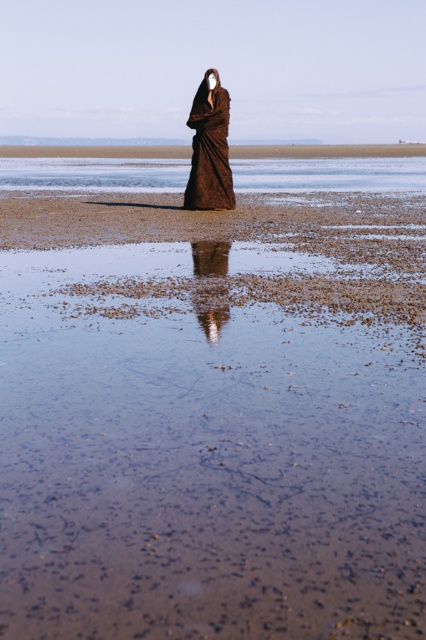
Is brown textured robe at center positioned at the back of smooth brown hair at center?

That is True.

Can you confirm if brown textured robe at center is bigger than smooth brown hair at center?

Yes, brown textured robe at center is bigger than smooth brown hair at center.

The width and height of the screenshot is (426, 640). Find the location of `brown textured robe at center`. brown textured robe at center is located at coordinates (210, 148).

Is point (5, 621) closer to viewer compared to point (207, 90)?

Yes, point (5, 621) is in front of point (207, 90).

What do you see at coordinates (212, 417) in the screenshot?
I see `brown matte sand at center` at bounding box center [212, 417].

Where is `brown matte sand at center`? brown matte sand at center is located at coordinates (212, 417).

Is clear water at center closer to the viewer compared to brown textured robe at center?

No, it is behind brown textured robe at center.

Who is more distant from viewer, (238, 168) or (221, 116)?

The point (238, 168) is behind.

Between point (176, 173) and point (227, 173), which one is positioned in front?

Positioned in front is point (227, 173).

Where is `clear water at center`? This screenshot has width=426, height=640. clear water at center is located at coordinates (328, 173).